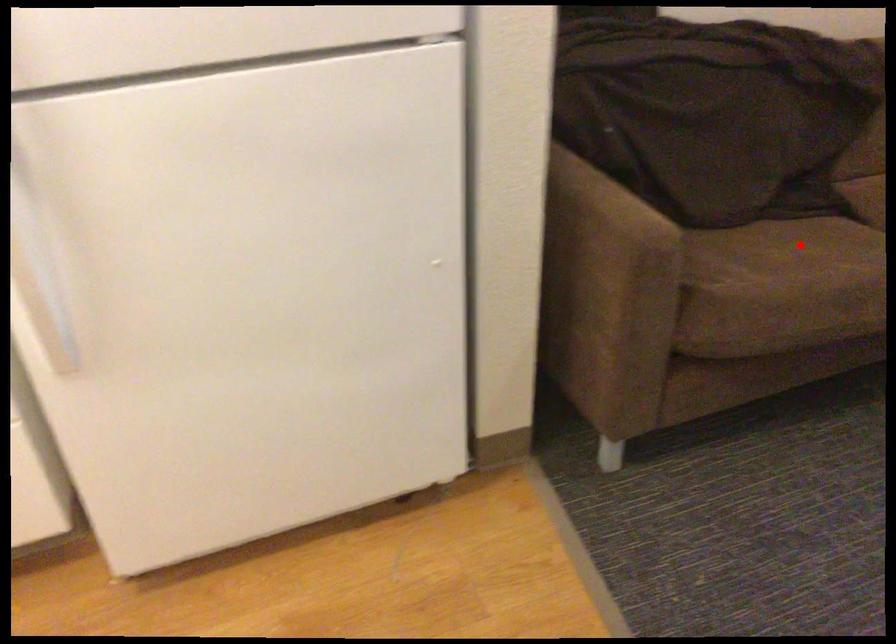
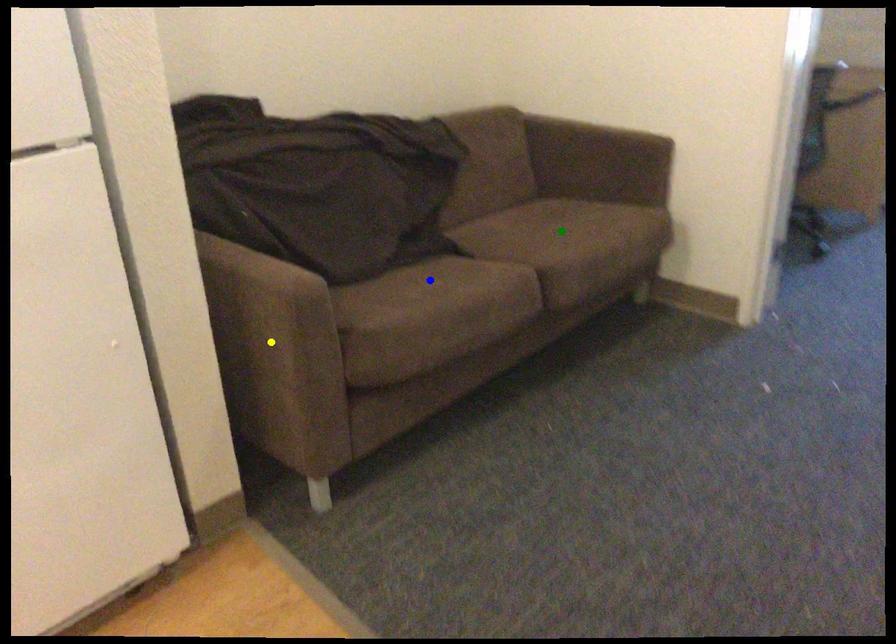
Question: I am providing you with two images of the same scene from different viewpoints. A red point is marked on the first image. You are given multiple points on the second image. Which point in image 2 is actually the same real-world point as the red point in image 1?

Choices:
 (A) yellow point
 (B) blue point
 (C) green point

Answer: (B)